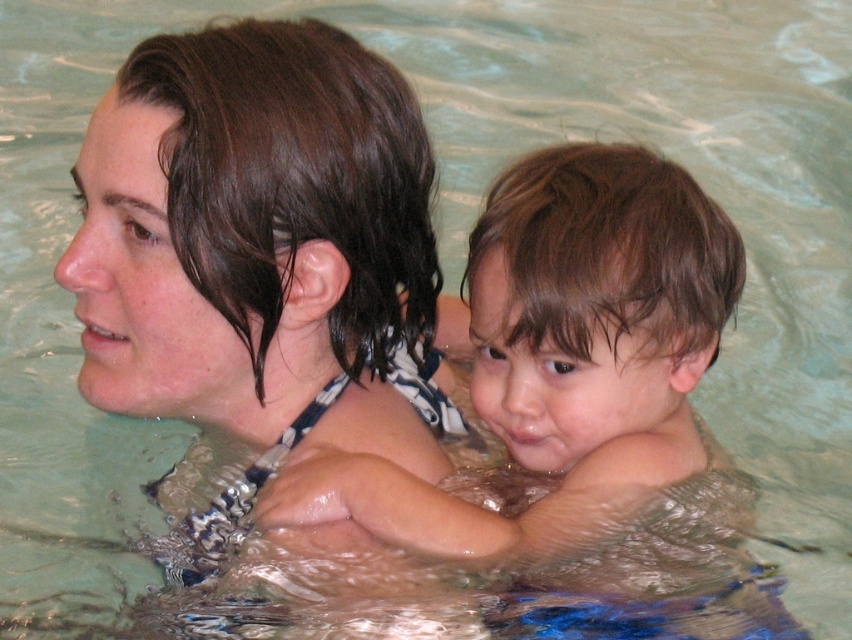
Question: Can you confirm if wet hair at upper left is bigger than wet skin child at center?

Choices:
 (A) yes
 (B) no

Answer: (A)

Question: Which of the following is the closest to the observer?

Choices:
 (A) (84, 266)
 (B) (384, 467)

Answer: (A)

Question: Can you confirm if wet hair at upper left is thinner than wet skin child at center?

Choices:
 (A) no
 (B) yes

Answer: (B)

Question: Does wet hair at upper left have a larger size compared to wet skin child at center?

Choices:
 (A) no
 (B) yes

Answer: (B)

Question: Among these objects, which one is nearest to the camera?

Choices:
 (A) wet hair at upper left
 (B) wet skin child at center

Answer: (A)